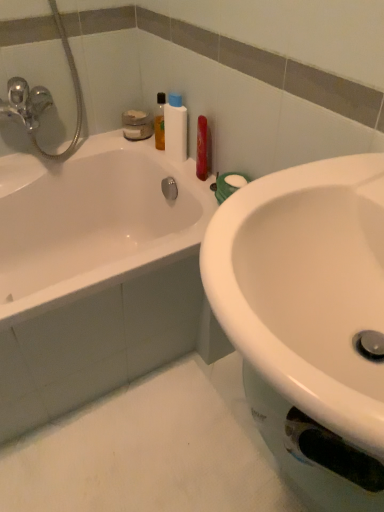
Question: Is white glossy bathtub at upper left oriented away from white glossy sink at center?

Choices:
 (A) no
 (B) yes

Answer: (A)

Question: Can you confirm if white glossy bathtub at upper left is wider than white glossy sink at center?

Choices:
 (A) no
 (B) yes

Answer: (B)

Question: From a real-world perspective, is white glossy bathtub at upper left over white glossy sink at center?

Choices:
 (A) yes
 (B) no

Answer: (B)

Question: Is white glossy bathtub at upper left outside of white glossy sink at center?

Choices:
 (A) yes
 (B) no

Answer: (A)

Question: Is white glossy bathtub at upper left thinner than white glossy sink at center?

Choices:
 (A) no
 (B) yes

Answer: (A)

Question: From a real-world perspective, is white glossy bathtub at upper left positioned above or below white glossy sink at center?

Choices:
 (A) above
 (B) below

Answer: (B)

Question: In the image, is white glossy bathtub at upper left on the left side or the right side of white glossy sink at center?

Choices:
 (A) right
 (B) left

Answer: (B)

Question: Considering the positions of white glossy bathtub at upper left and white glossy sink at center in the image, is white glossy bathtub at upper left bigger or smaller than white glossy sink at center?

Choices:
 (A) small
 (B) big

Answer: (B)

Question: From the image's perspective, is white glossy bathtub at upper left located above or below white glossy sink at center?

Choices:
 (A) above
 (B) below

Answer: (A)

Question: From a real-world perspective, relative to white glossy bathtub at upper left, is white plastic bottle at upper center vertically above or below?

Choices:
 (A) below
 (B) above

Answer: (B)

Question: Considering their positions, is white plastic bottle at upper center located in front of or behind white glossy bathtub at upper left?

Choices:
 (A) behind
 (B) front

Answer: (A)

Question: From the image's perspective, is white plastic bottle at upper center located above or below white glossy bathtub at upper left?

Choices:
 (A) below
 (B) above

Answer: (B)

Question: Considering the positions of point (182, 125) and point (102, 201), is point (182, 125) closer or farther from the camera than point (102, 201)?

Choices:
 (A) farther
 (B) closer

Answer: (B)

Question: Is white glossy sink at center wider or thinner than white glossy bathtub at upper left?

Choices:
 (A) thin
 (B) wide

Answer: (A)

Question: From a real-world perspective, is white glossy sink at center physically located above or below white glossy bathtub at upper left?

Choices:
 (A) below
 (B) above

Answer: (B)